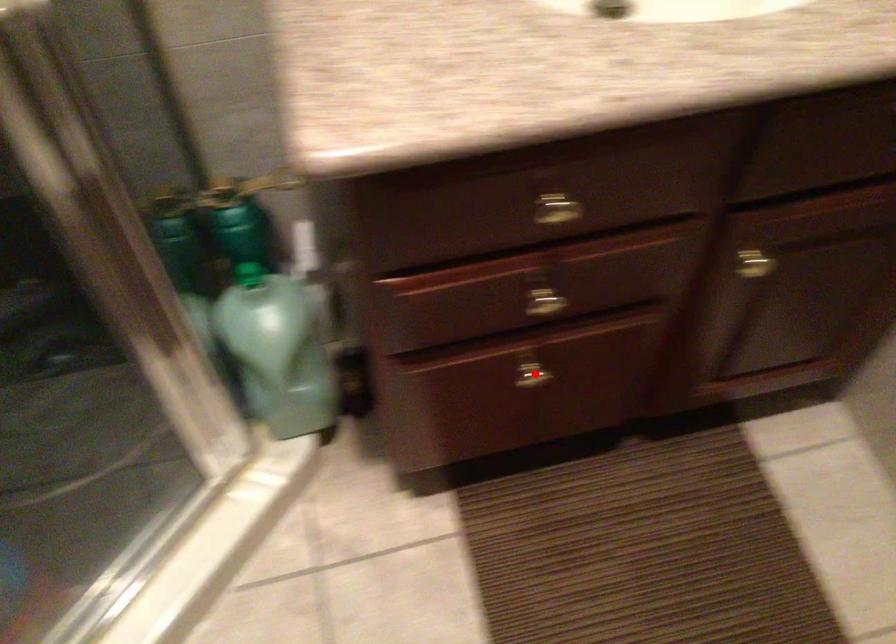
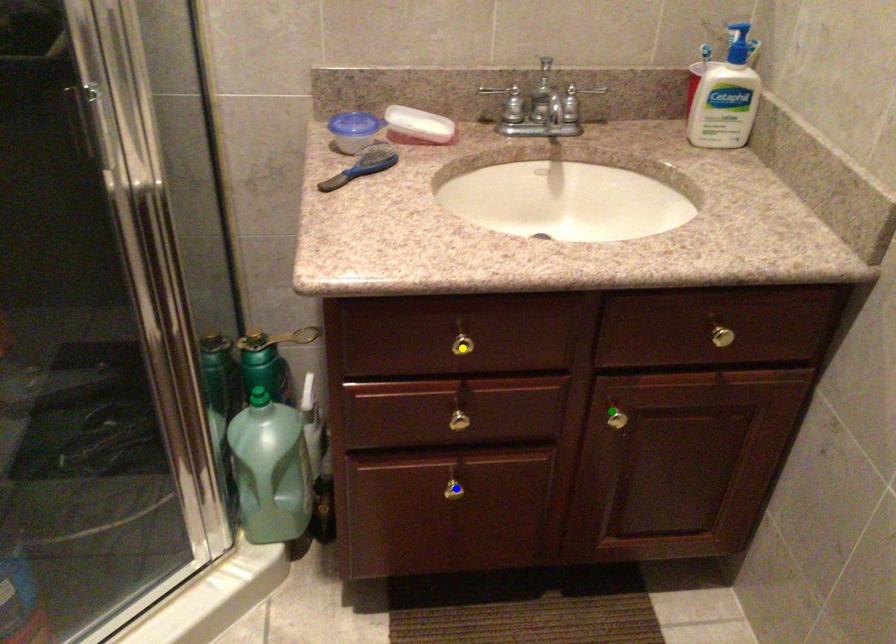
Question: I am providing you with two images of the same scene from different viewpoints. A red point is marked on the first image. You are given multiple points on the second image. Can you choose the point in image 2 that corresponds to the point in image 1?

Choices:
 (A) blue point
 (B) yellow point
 (C) green point

Answer: (A)